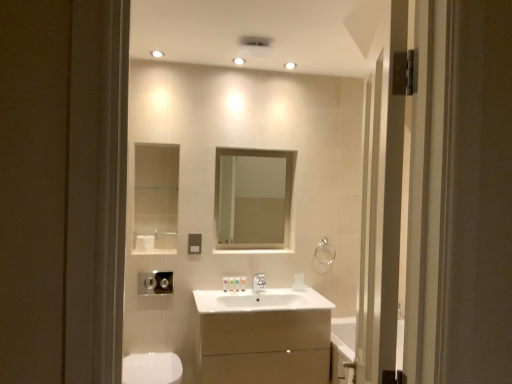
Question: Can you confirm if white glossy light fixture at upper center is positioned to the right of silver metallic faucet at center?

Choices:
 (A) yes
 (B) no

Answer: (A)

Question: From the image's perspective, does white glossy light fixture at upper center appear higher than silver metallic faucet at center?

Choices:
 (A) yes
 (B) no

Answer: (A)

Question: Is white glossy light fixture at upper center further to the viewer compared to silver metallic faucet at center?

Choices:
 (A) yes
 (B) no

Answer: (A)

Question: Is the surface of white glossy light fixture at upper center in direct contact with silver metallic faucet at center?

Choices:
 (A) yes
 (B) no

Answer: (B)

Question: Is white glossy light fixture at upper center thinner than silver metallic faucet at center?

Choices:
 (A) yes
 (B) no

Answer: (A)

Question: Is white glossy light fixture at upper center not inside silver metallic faucet at center?

Choices:
 (A) no
 (B) yes

Answer: (B)

Question: Is silver metallic faucet at center outside of matte silver switch at center?

Choices:
 (A) yes
 (B) no

Answer: (A)

Question: From the image's perspective, is silver metallic faucet at center located above matte silver switch at center?

Choices:
 (A) no
 (B) yes

Answer: (A)

Question: Is matte silver switch at center at the back of silver metallic faucet at center?

Choices:
 (A) no
 (B) yes

Answer: (A)

Question: Does silver metallic faucet at center have a smaller size compared to matte silver switch at center?

Choices:
 (A) no
 (B) yes

Answer: (A)

Question: Considering the relative sizes of silver metallic faucet at center and matte silver switch at center in the image provided, is silver metallic faucet at center wider than matte silver switch at center?

Choices:
 (A) no
 (B) yes

Answer: (B)

Question: Can you confirm if silver metallic faucet at center is positioned to the right of matte silver switch at center?

Choices:
 (A) no
 (B) yes

Answer: (B)

Question: Is silver metallic faucet at center surrounding white glossy light fixture at upper center?

Choices:
 (A) yes
 (B) no

Answer: (B)